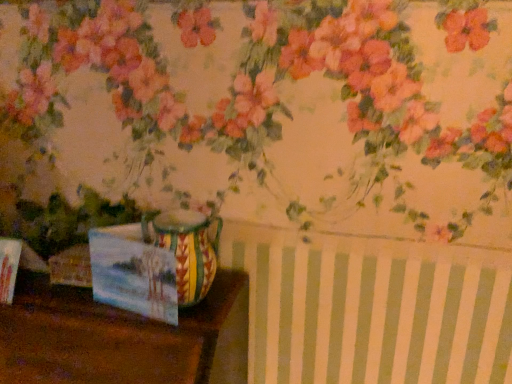
Question: From a real-world perspective, is matte paper postcard at lower left located beneath wooden table at lower left?

Choices:
 (A) no
 (B) yes

Answer: (A)

Question: Can you confirm if matte paper postcard at lower left is bigger than wooden table at lower left?

Choices:
 (A) yes
 (B) no

Answer: (B)

Question: Does matte paper postcard at lower left turn towards wooden table at lower left?

Choices:
 (A) yes
 (B) no

Answer: (B)

Question: Is matte paper postcard at lower left looking in the opposite direction of wooden table at lower left?

Choices:
 (A) yes
 (B) no

Answer: (B)

Question: Is matte paper postcard at lower left taller than wooden table at lower left?

Choices:
 (A) no
 (B) yes

Answer: (A)

Question: Is matte paper postcard at lower left not close to wooden table at lower left?

Choices:
 (A) yes
 (B) no

Answer: (B)

Question: From the image's perspective, is wooden table at lower left on top of matte paper postcard at lower left?

Choices:
 (A) no
 (B) yes

Answer: (A)

Question: Does wooden table at lower left lie in front of matte paper postcard at lower left?

Choices:
 (A) no
 (B) yes

Answer: (B)

Question: Is wooden table at lower left at the left side of matte paper postcard at lower left?

Choices:
 (A) yes
 (B) no

Answer: (A)

Question: Considering the relative sizes of wooden table at lower left and matte paper postcard at lower left in the image provided, is wooden table at lower left wider than matte paper postcard at lower left?

Choices:
 (A) yes
 (B) no

Answer: (A)

Question: Is wooden table at lower left bigger than matte paper postcard at lower left?

Choices:
 (A) yes
 (B) no

Answer: (A)

Question: Could matte paper postcard at lower left be considered to be inside wooden table at lower left?

Choices:
 (A) yes
 (B) no

Answer: (B)

Question: Is matte paper postcard at lower left taller than multicolored ceramic vase at center?

Choices:
 (A) yes
 (B) no

Answer: (B)